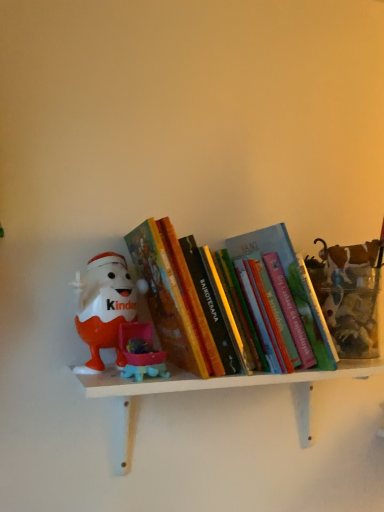
Question: Does hardcover book at center have a smaller size compared to matte plastic kinder egg at left?

Choices:
 (A) yes
 (B) no

Answer: (B)

Question: Is hardcover book at center wider than matte plastic kinder egg at left?

Choices:
 (A) yes
 (B) no

Answer: (A)

Question: Is hardcover book at center in front of matte plastic kinder egg at left?

Choices:
 (A) yes
 (B) no

Answer: (A)

Question: Is there a large distance between hardcover book at center and matte plastic kinder egg at left?

Choices:
 (A) yes
 (B) no

Answer: (B)

Question: From the image's perspective, is hardcover book at center located beneath matte plastic kinder egg at left?

Choices:
 (A) no
 (B) yes

Answer: (A)

Question: From a real-world perspective, is hardcover book at center on matte plastic kinder egg at left?

Choices:
 (A) no
 (B) yes

Answer: (B)

Question: Is matte plastic kinder egg at left at the left side of hardcover book at center?

Choices:
 (A) yes
 (B) no

Answer: (A)

Question: Is matte plastic kinder egg at left thinner than hardcover book at center?

Choices:
 (A) yes
 (B) no

Answer: (A)

Question: Is matte plastic kinder egg at left oriented towards hardcover book at center?

Choices:
 (A) no
 (B) yes

Answer: (A)

Question: Does matte plastic kinder egg at left contain hardcover book at center?

Choices:
 (A) no
 (B) yes

Answer: (A)

Question: Is matte plastic kinder egg at left oriented away from hardcover book at center?

Choices:
 (A) no
 (B) yes

Answer: (A)

Question: Is matte plastic kinder egg at left wider than hardcover book at center?

Choices:
 (A) yes
 (B) no

Answer: (B)

Question: From the image's perspective, is hardcover book at center on white matte shelf at center?

Choices:
 (A) no
 (B) yes

Answer: (B)